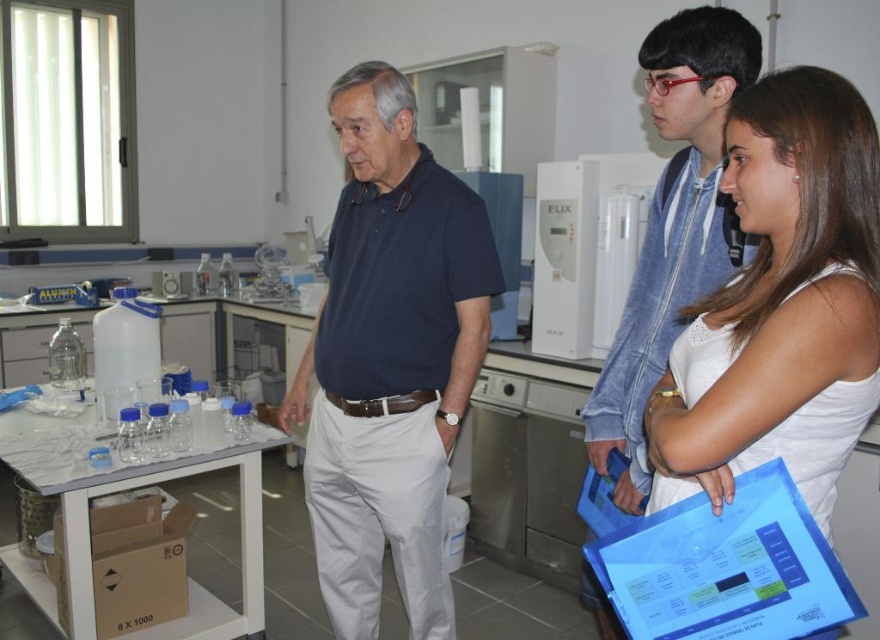
Question: Which is nearer to the white matte tank top at upper right?

Choices:
 (A) dark blue cotton polo shirt at center
 (B) blue denim jacket at upper right

Answer: (B)

Question: Estimate the real-world distances between objects in this image. Which object is closer to the blue denim jacket at upper right?

Choices:
 (A) dark blue cotton polo shirt at center
 (B) white matte tank top at upper right

Answer: (B)

Question: Is dark blue cotton polo shirt at center to the left of blue denim jacket at upper right from the viewer's perspective?

Choices:
 (A) no
 (B) yes

Answer: (B)

Question: Which point is closer to the camera?

Choices:
 (A) (672, 324)
 (B) (752, 321)
 (C) (364, 282)

Answer: (B)

Question: From the image, what is the correct spatial relationship of white matte tank top at upper right in relation to blue denim jacket at upper right?

Choices:
 (A) above
 (B) below

Answer: (B)

Question: Does white matte tank top at upper right have a greater width compared to blue denim jacket at upper right?

Choices:
 (A) yes
 (B) no

Answer: (A)